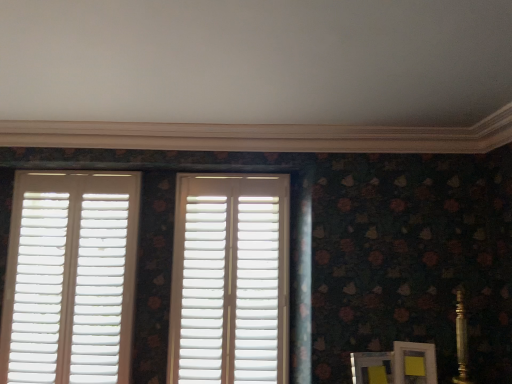
The width and height of the screenshot is (512, 384). Describe the element at coordinates (70, 278) in the screenshot. I see `white matte shutters at left, the 1th window viewed from the left` at that location.

Locate an element on the screen. white matte shutters at left, positioned as the 2th window in right-to-left order is located at coordinates (70, 278).

This screenshot has height=384, width=512. Describe the element at coordinates (230, 280) in the screenshot. I see `white matte shutters at center, arranged as the first window when viewed from the right` at that location.

This screenshot has width=512, height=384. Find the location of `white matte shutters at center, the second window viewed from the left`. white matte shutters at center, the second window viewed from the left is located at coordinates (230, 280).

Locate an element on the screen. This screenshot has height=384, width=512. white matte shutters at left, the 1th window viewed from the left is located at coordinates (70, 278).

Considering the positions of objects white matte shutters at center, arranged as the first window when viewed from the right, and white matte shutters at left, the 1th window viewed from the left, in the image provided, who is more to the right, white matte shutters at center, arranged as the first window when viewed from the right, or white matte shutters at left, the 1th window viewed from the left,?

Positioned to the right is white matte shutters at center, arranged as the first window when viewed from the right.

Relative to white matte shutters at left, positioned as the 2th window in right-to-left order, is white matte shutters at center, arranged as the first window when viewed from the right, in front or behind?

Clearly, white matte shutters at center, arranged as the first window when viewed from the right, is in front of white matte shutters at left, positioned as the 2th window in right-to-left order.

Does point (282, 227) come closer to viewer compared to point (10, 314)?

No, (282, 227) is behind (10, 314).

From the image's perspective, is white matte shutters at center, the second window viewed from the left, located above white matte shutters at left, positioned as the 2th window in right-to-left order?

Yes, from the image's perspective, white matte shutters at center, the second window viewed from the left, is on top of white matte shutters at left, positioned as the 2th window in right-to-left order.

From a real-world perspective, relative to white matte shutters at left, the 1th window viewed from the left, is white matte shutters at center, arranged as the first window when viewed from the right, vertically above or below?

white matte shutters at center, arranged as the first window when viewed from the right, is situated higher than white matte shutters at left, the 1th window viewed from the left, in the real world.

Looking at their sizes, would you say white matte shutters at center, arranged as the first window when viewed from the right, is wider or thinner than white matte shutters at left, the 1th window viewed from the left?

Clearly, white matte shutters at center, arranged as the first window when viewed from the right, has less width compared to white matte shutters at left, the 1th window viewed from the left.

Who is shorter, white matte shutters at center, arranged as the first window when viewed from the right, or white matte shutters at left, the 1th window viewed from the left?

white matte shutters at center, arranged as the first window when viewed from the right.

Can you confirm if white matte shutters at center, arranged as the first window when viewed from the right, is smaller than white matte shutters at left, positioned as the 2th window in right-to-left order?

Yes.

Is white matte shutters at center, the second window viewed from the left, not within white matte shutters at left, positioned as the 2th window in right-to-left order?

Yes.

Is white matte shutters at center, arranged as the first window when viewed from the right, directly adjacent to white matte shutters at left, positioned as the 2th window in right-to-left order?

white matte shutters at center, arranged as the first window when viewed from the right, and white matte shutters at left, positioned as the 2th window in right-to-left order, are clearly separated.

Could you tell me if white matte shutters at center, the second window viewed from the left, is facing white matte shutters at left, positioned as the 2th window in right-to-left order?

No, white matte shutters at center, the second window viewed from the left, is not aimed at white matte shutters at left, positioned as the 2th window in right-to-left order.

This screenshot has height=384, width=512. Identify the location of window below the white matte shutters at center, arranged as the first window when viewed from the right (from a real-world perspective). (70, 278).

Can you confirm if white matte shutters at left, positioned as the 2th window in right-to-left order, is positioned to the left of white matte shutters at center, the second window viewed from the left?

Correct, you'll find white matte shutters at left, positioned as the 2th window in right-to-left order, to the left of white matte shutters at center, the second window viewed from the left.

Is white matte shutters at left, the 1th window viewed from the left, in front of or behind white matte shutters at center, arranged as the first window when viewed from the right, in the image?

In the image, white matte shutters at left, the 1th window viewed from the left, appears behind white matte shutters at center, arranged as the first window when viewed from the right.

Is point (104, 380) positioned before point (193, 303)?

Yes.

From the image's perspective, which one is positioned lower, white matte shutters at left, the 1th window viewed from the left, or white matte shutters at center, arranged as the first window when viewed from the right?

white matte shutters at left, the 1th window viewed from the left, is shown below in the image.

From a real-world perspective, does white matte shutters at left, positioned as the 2th window in right-to-left order, stand above white matte shutters at center, the second window viewed from the left?

No, from a real-world perspective, white matte shutters at left, positioned as the 2th window in right-to-left order, is not above white matte shutters at center, the second window viewed from the left.

Considering the sizes of objects white matte shutters at left, the 1th window viewed from the left, and white matte shutters at center, the second window viewed from the left, in the image provided, who is wider, white matte shutters at left, the 1th window viewed from the left, or white matte shutters at center, the second window viewed from the left,?

white matte shutters at left, the 1th window viewed from the left.

Can you confirm if white matte shutters at left, positioned as the 2th window in right-to-left order, is shorter than white matte shutters at center, the second window viewed from the left?

Incorrect, the height of white matte shutters at left, positioned as the 2th window in right-to-left order, does not fall short of that of white matte shutters at center, the second window viewed from the left.

Which of these two, white matte shutters at left, positioned as the 2th window in right-to-left order, or white matte shutters at center, arranged as the first window when viewed from the right, is smaller?

white matte shutters at center, arranged as the first window when viewed from the right.

Is white matte shutters at left, positioned as the 2th window in right-to-left order, completely or partially outside of white matte shutters at center, arranged as the first window when viewed from the right?

Indeed, white matte shutters at left, positioned as the 2th window in right-to-left order, is completely outside white matte shutters at center, arranged as the first window when viewed from the right.

Is white matte shutters at left, positioned as the 2th window in right-to-left order, oriented away from white matte shutters at center, the second window viewed from the left?

No, white matte shutters at left, positioned as the 2th window in right-to-left order,'s orientation is not away from white matte shutters at center, the second window viewed from the left.

How much distance is there between white matte shutters at left, the 1th window viewed from the left, and white matte shutters at center, the second window viewed from the left?

22.30 inches.

The height and width of the screenshot is (384, 512). I want to click on window that is on the right side of white matte shutters at left, positioned as the 2th window in right-to-left order, so click(x=230, y=280).

This screenshot has width=512, height=384. I want to click on window that appears on the left of white matte shutters at center, arranged as the first window when viewed from the right, so click(70, 278).

Locate an element on the screen. The width and height of the screenshot is (512, 384). window below the white matte shutters at center, the second window viewed from the left (from a real-world perspective) is located at coordinates (70, 278).